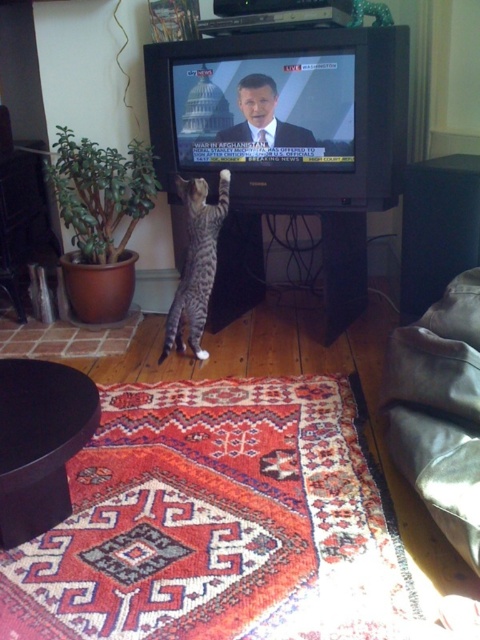
You are a delivery person who needs to place a new cat toy box that is 1.2 meters wide between the black plastic tv at center and the striped fur cat at center. Based on the scene description, can the cat toy box fit in the space between them?

The black plastic tv at center might be wider than striped fur cat at center, so the space between them may not be wide enough to fit the 1.2 meter wide cat toy box. Check the actual distance before placing it.

You are a pet sitter in the living room and notice the black plastic tv at center and the striped fur cat at center. Which object is positioned higher in the scene?

The black plastic tv at center is located above the striped fur cat at center, so the TV is higher up.

Looking at this image, you are a pet sitter observing the scene. The black plastic tv at center and the striped fur cat at center are both in the living room. Which object is larger in size?

The black plastic tv at center is bigger than the striped fur cat at center.